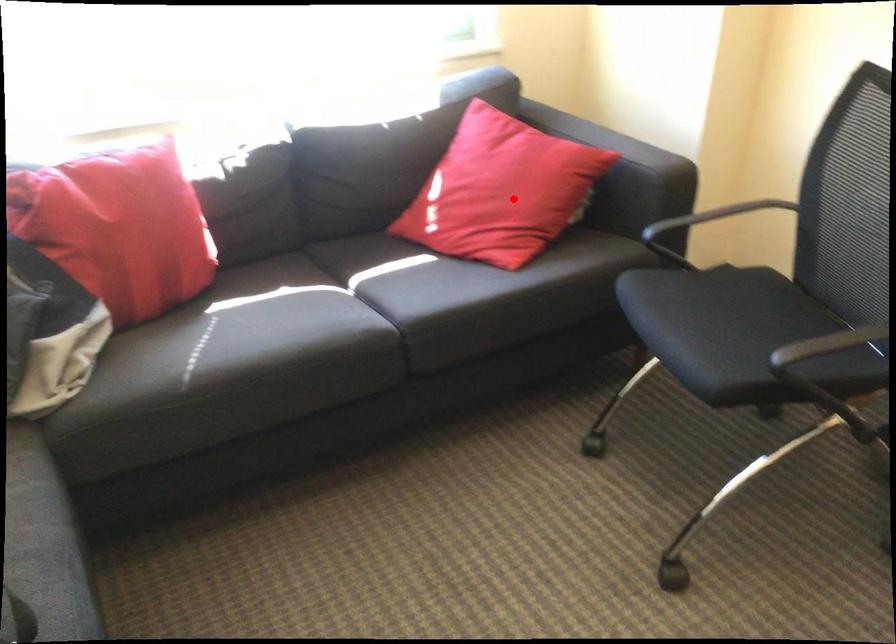
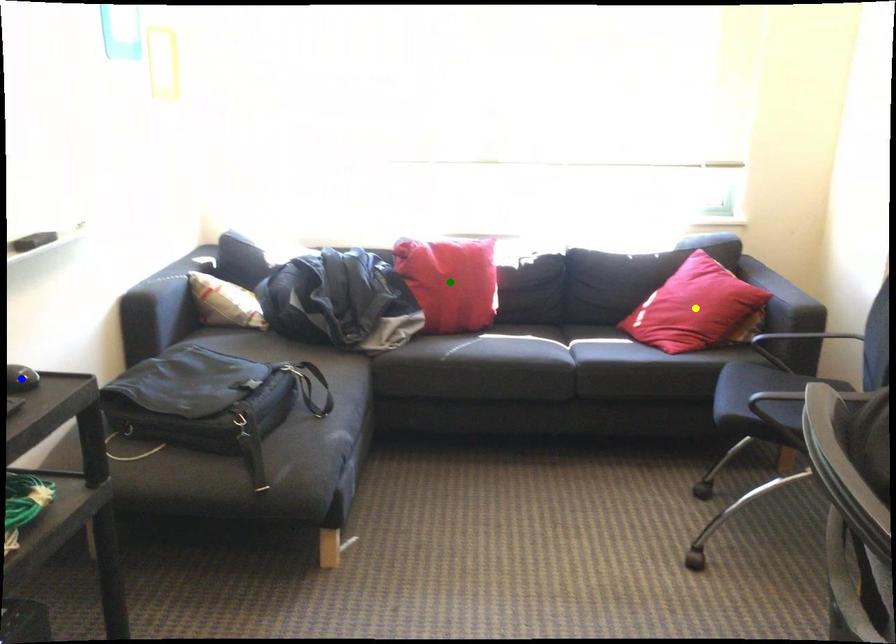
Question: I am providing you with two images of the same scene from different viewpoints. A red point is marked on the first image. You are given multiple points on the second image. Which point in image 2 represents the same 3d spot as the red point in image 1?

Choices:
 (A) yellow point
 (B) blue point
 (C) green point

Answer: (A)